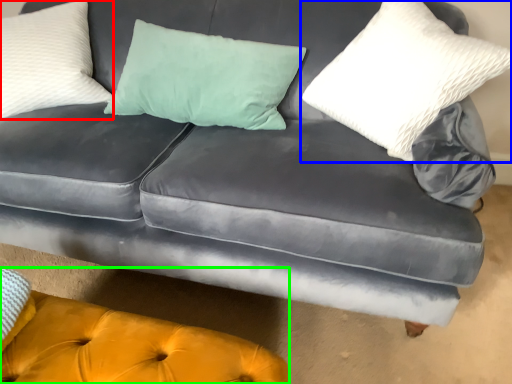
Question: Considering the real-world distances, which object is farthest from pillow (highlighted by a red box)? pillow (highlighted by a blue box) or couch (highlighted by a green box)?

Choices:
 (A) pillow
 (B) couch

Answer: (A)